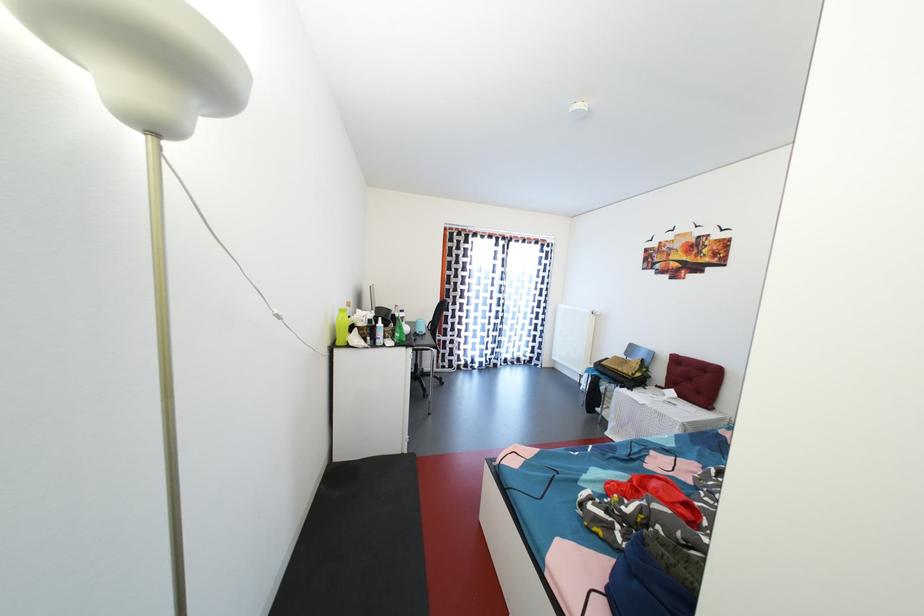
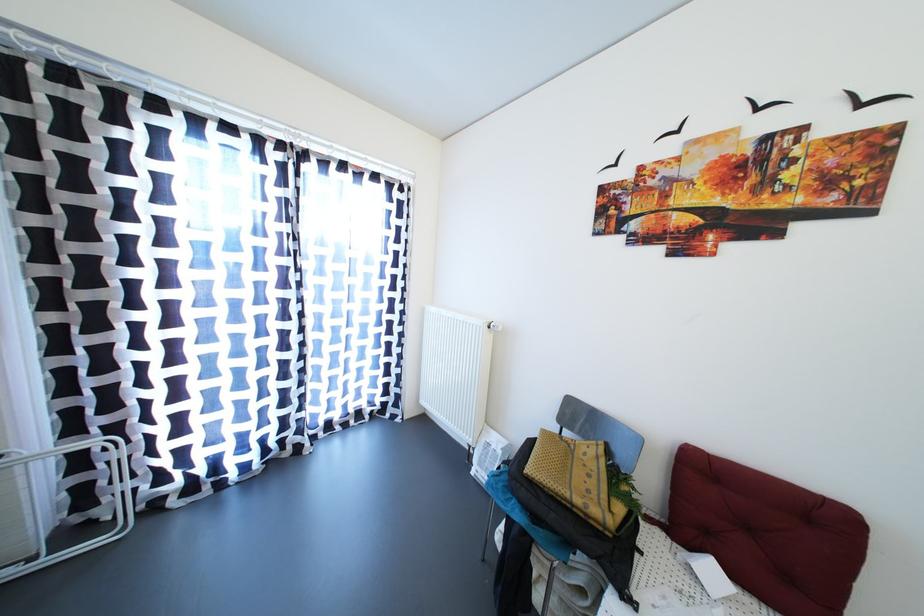
Find the pixel in the second image that matches point (626, 374) in the first image.

(584, 506)